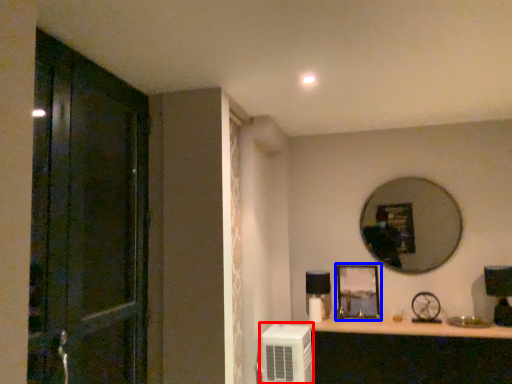
Question: Which point is closer to the camera, air conditioner (highlighted by a red box) or picture frame (highlighted by a blue box)?

Choices:
 (A) air conditioner
 (B) picture frame

Answer: (A)